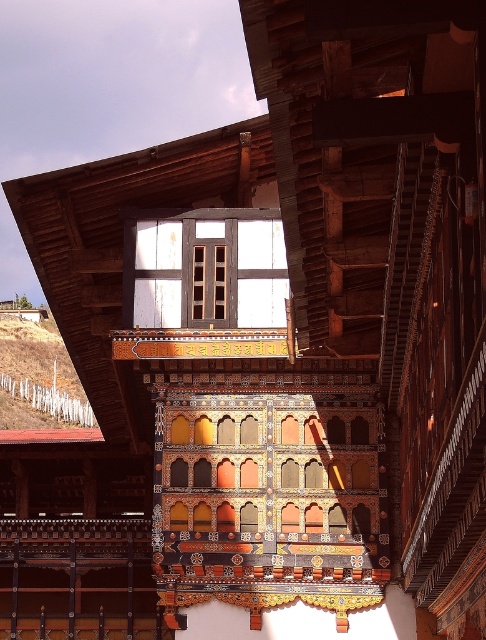
Question: Does white painted wood at center have a larger size compared to brown grass at lower left?

Choices:
 (A) no
 (B) yes

Answer: (A)

Question: Does white painted wood at center have a smaller size compared to brown grass at lower left?

Choices:
 (A) no
 (B) yes

Answer: (B)

Question: Does white painted wood at center have a greater width compared to brown grass at lower left?

Choices:
 (A) no
 (B) yes

Answer: (A)

Question: Which of the following is the closest to the observer?

Choices:
 (A) tap(75, 390)
 (B) tap(261, 230)

Answer: (B)

Question: Which of the following is the farthest from the observer?

Choices:
 (A) brown grass at lower left
 (B) white painted wood at center

Answer: (A)